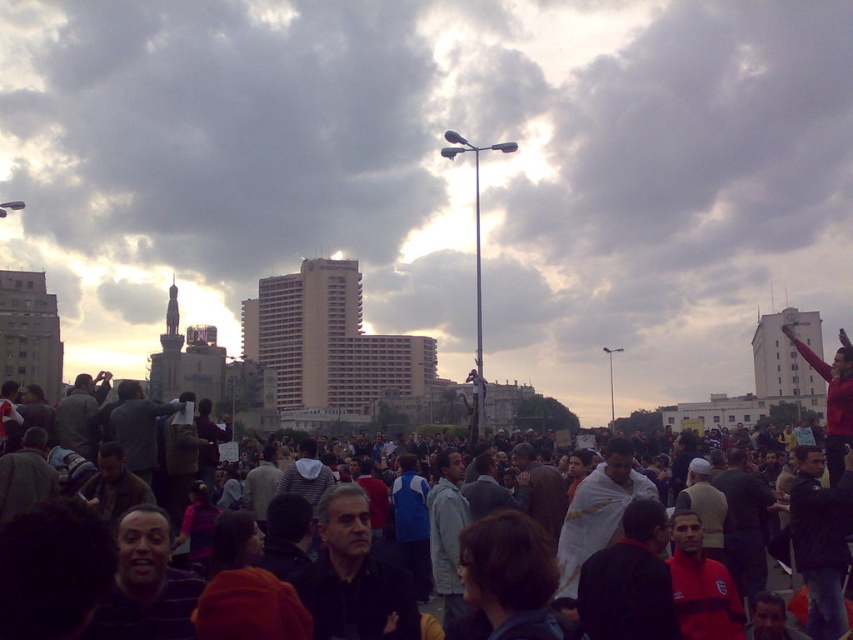
Is cloudy sky at upper center above dark clothing crowd at center?

Indeed, cloudy sky at upper center is positioned over dark clothing crowd at center.

Between point (787, 20) and point (813, 515), which one is positioned in front?

Point (813, 515)

I want to click on cloudy sky at upper center, so click(439, 172).

Where is `cloudy sky at upper center`? Image resolution: width=853 pixels, height=640 pixels. cloudy sky at upper center is located at coordinates (439, 172).